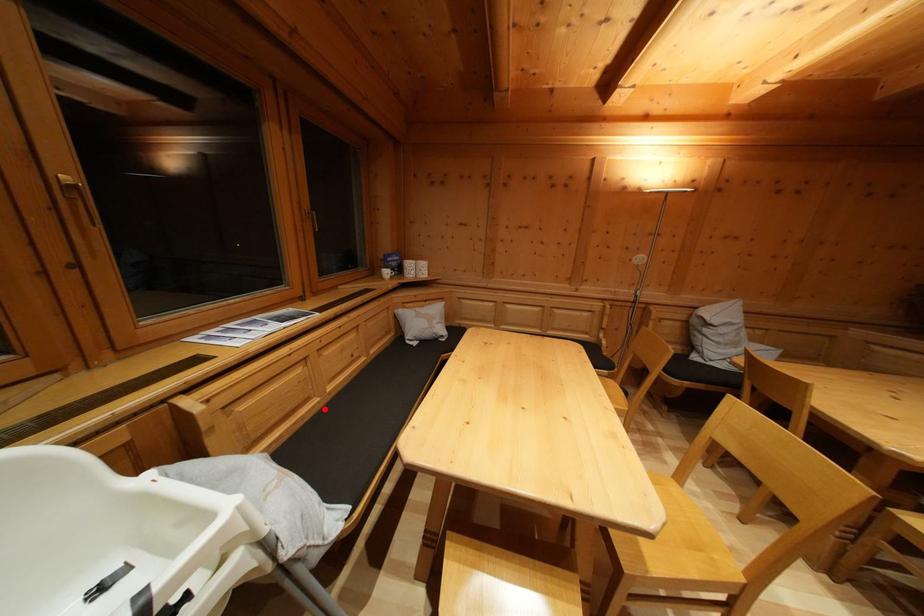
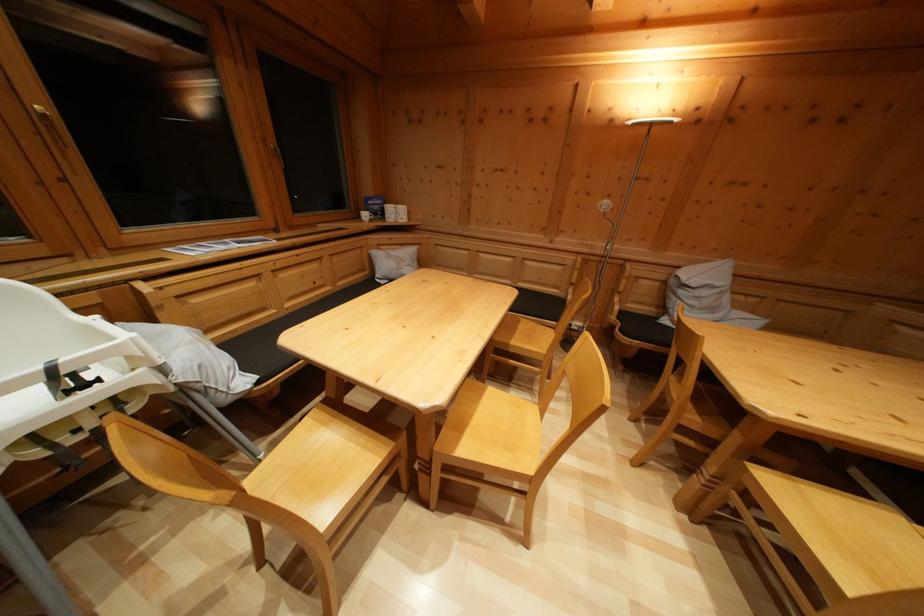
Where in the second image is the point corresponding to the highlighted location from the first image?

(282, 321)